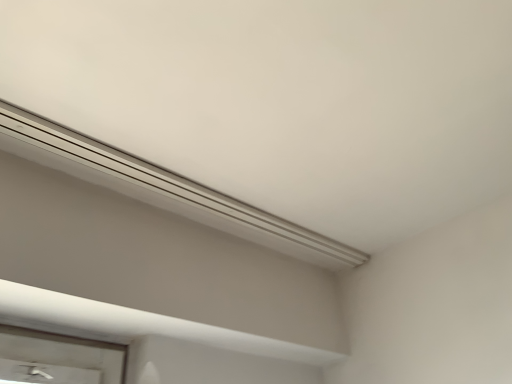
Describe the element at coordinates (163, 188) in the screenshot. I see `metallic silver exhaust hood at upper center` at that location.

Locate an element on the screen. This screenshot has width=512, height=384. metallic silver exhaust hood at upper center is located at coordinates (163, 188).

Locate an element on the screen. metallic silver exhaust hood at upper center is located at coordinates (163, 188).